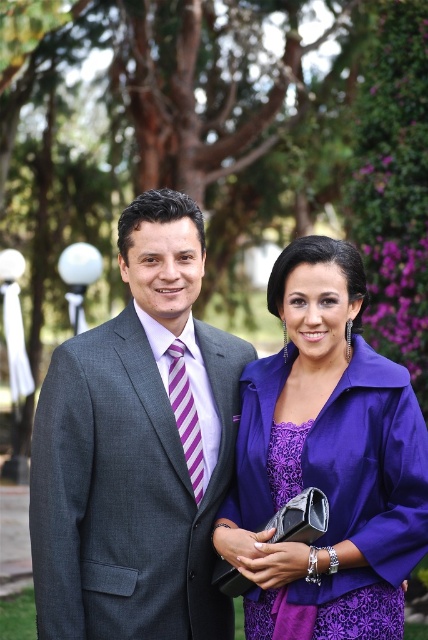
Does purple satin dress at center have a greater width compared to purple striped tie at center?

Yes.

In the scene shown: Is purple satin dress at center bigger than purple striped tie at center?

Yes, purple satin dress at center is bigger than purple striped tie at center.

Locate an element on the screen. purple satin dress at center is located at coordinates (326, 461).

Where is `purple satin dress at center`? purple satin dress at center is located at coordinates (326, 461).

Which is more to the right, matte gray suit at center or purple satin dress at center?

From the viewer's perspective, purple satin dress at center appears more on the right side.

Locate an element on the screen. The height and width of the screenshot is (640, 428). matte gray suit at center is located at coordinates tap(137, 449).

Between point (149, 532) and point (407, 512), which one is positioned in front?

Point (407, 512)

Locate an element on the screen. Image resolution: width=428 pixels, height=640 pixels. matte gray suit at center is located at coordinates (137, 449).

Looking at this image, who is more distant from viewer, (36, 588) or (171, 365)?

Point (171, 365)

The width and height of the screenshot is (428, 640). I want to click on matte gray suit at center, so click(137, 449).